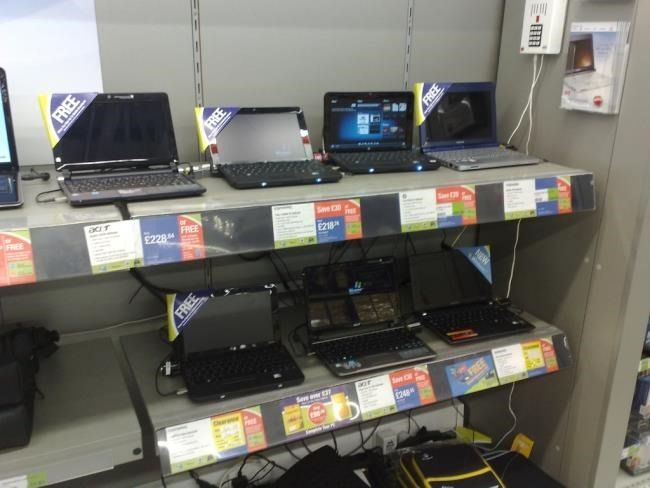
Locate an element on the screen. grey display shelf is located at coordinates (117, 430).